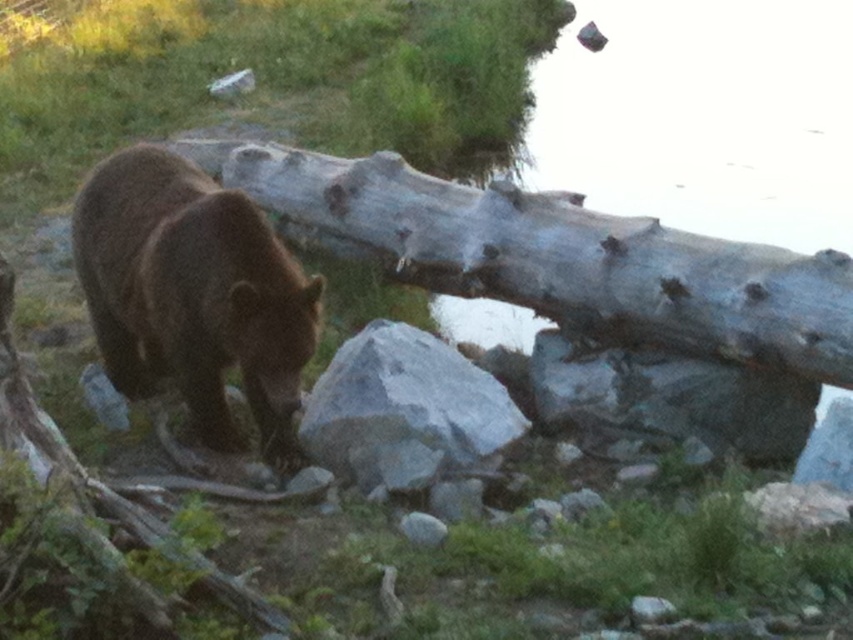
Does gray rough log at center lie in front of brown furry bear at lower left?

No, it is not.

Between point (450, 280) and point (244, 330), which one is positioned behind?

Point (450, 280)

Does point (637, 260) lie in front of point (219, 424)?

That is False.

The image size is (853, 640). In order to click on gray rough log at center in this screenshot , I will do `click(566, 259)`.

Which is behind, point (270, 410) or point (474, 422)?

The point (474, 422) is behind.

Can you confirm if brown furry bear at lower left is wider than gray rock at center?

Indeed, brown furry bear at lower left has a greater width compared to gray rock at center.

Does point (126, 358) come farther from viewer compared to point (469, 456)?

That is True.

The image size is (853, 640). Find the location of `brown furry bear at lower left`. brown furry bear at lower left is located at coordinates (193, 294).

Which of these two, gray rough log at center or gray rock at center, stands taller?

With more height is gray rough log at center.

You are a GUI agent. You are given a task and a screenshot of the screen. Output one action in this format:
    pyautogui.click(x=<x>, y=<y>)
    Task: Click on the gray rough log at center
    
    Given the screenshot: What is the action you would take?
    pyautogui.click(x=566, y=259)

Is point (576, 205) positioned in front of point (422, 392)?

No, it is not.

What are the coordinates of `gray rough log at center` in the screenshot? It's located at (566, 259).